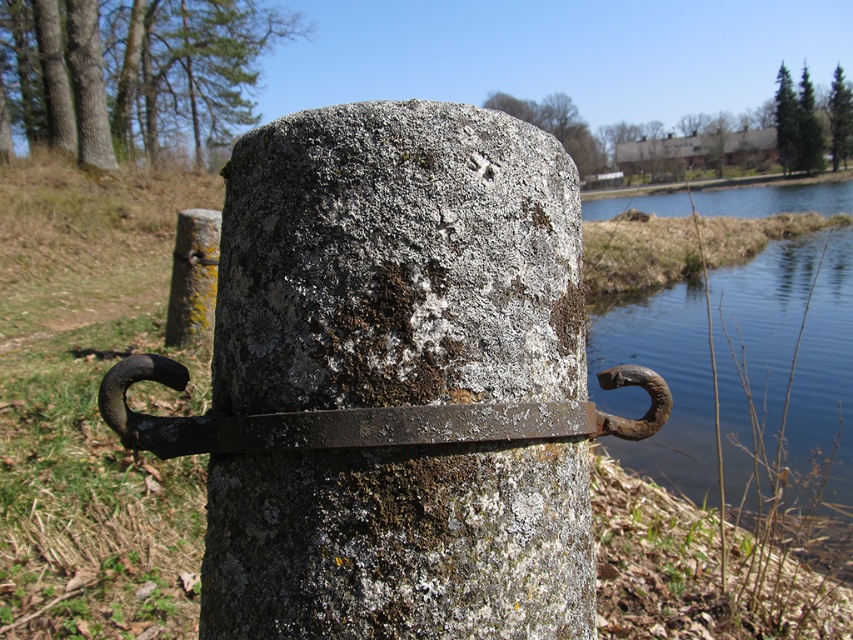
Does rusty metal post at center have a lesser height compared to rusty metal hook at center?

No.

Is rusty metal post at center further to the viewer compared to rusty metal hook at center?

Yes.

Locate an element on the screen. The height and width of the screenshot is (640, 853). rusty metal post at center is located at coordinates (397, 262).

Locate an element on the screen. This screenshot has width=853, height=640. rusty metal post at center is located at coordinates (397, 262).

Can you confirm if rusty metal post at center is smaller than green mossy stone at center?

Indeed, rusty metal post at center has a smaller size compared to green mossy stone at center.

Does rusty metal post at center appear over green mossy stone at center?

No, rusty metal post at center is not above green mossy stone at center.

Which is in front, point (372, 452) or point (171, 310)?

Point (372, 452)

This screenshot has height=640, width=853. Find the location of `rusty metal post at center`. rusty metal post at center is located at coordinates (397, 262).

Who is taller, blue water at right or rusty metal hook at center?

blue water at right is taller.

Between blue water at right and rusty metal hook at center, which one is positioned lower?

rusty metal hook at center is lower down.

Measure the distance between point (824, 305) and camera.

Point (824, 305) is 19.86 meters away from camera.

What are the coordinates of `blue water at right` in the screenshot? It's located at (665, 380).